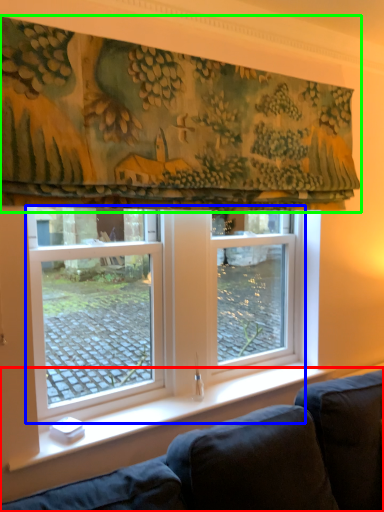
Question: Which object is the closest to the studio couch (highlighted by a red box)? Choose among these: window (highlighted by a blue box) or curtain (highlighted by a green box).

Choices:
 (A) window
 (B) curtain

Answer: (A)